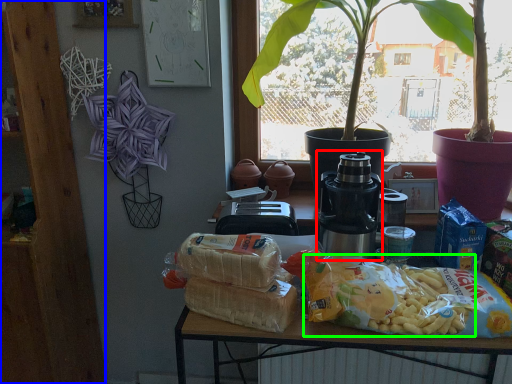
Question: Based on their relative distances, which object is nearer to yoghurt (highlighted by a red box)? Choose from bookshelf (highlighted by a blue box) and food (highlighted by a green box).

Choices:
 (A) bookshelf
 (B) food

Answer: (B)